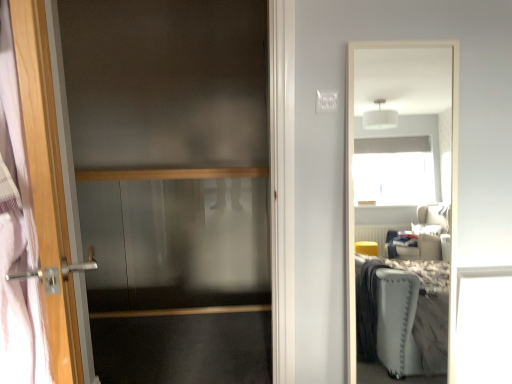
Question: Should I look upward or downward to see transparent glass screen door at left?

Choices:
 (A) down
 (B) up

Answer: (A)

Question: Is transparent glass screen door at left shorter than satin wood balustrade at center?

Choices:
 (A) yes
 (B) no

Answer: (B)

Question: Does transparent glass screen door at left have a smaller size compared to satin wood balustrade at center?

Choices:
 (A) no
 (B) yes

Answer: (A)

Question: Is transparent glass screen door at left looking in the opposite direction of satin wood balustrade at center?

Choices:
 (A) yes
 (B) no

Answer: (A)

Question: Can satin wood balustrade at center be found inside transparent glass screen door at left?

Choices:
 (A) yes
 (B) no

Answer: (B)

Question: Is transparent glass screen door at left wider than satin wood balustrade at center?

Choices:
 (A) no
 (B) yes

Answer: (A)

Question: Can you confirm if transparent glass screen door at left is positioned to the right of satin wood balustrade at center?

Choices:
 (A) yes
 (B) no

Answer: (A)

Question: Is transparent glass screen door at left to the left of wooden door handle at left from the viewer's perspective?

Choices:
 (A) yes
 (B) no

Answer: (B)

Question: Is wooden door handle at left located within transparent glass screen door at left?

Choices:
 (A) no
 (B) yes

Answer: (A)

Question: From the image's perspective, is transparent glass screen door at left below wooden door handle at left?

Choices:
 (A) yes
 (B) no

Answer: (B)

Question: Does transparent glass screen door at left have a greater width compared to wooden door handle at left?

Choices:
 (A) no
 (B) yes

Answer: (A)

Question: Considering the relative sizes of transparent glass screen door at left and wooden door handle at left in the image provided, is transparent glass screen door at left smaller than wooden door handle at left?

Choices:
 (A) yes
 (B) no

Answer: (A)

Question: Is transparent glass screen door at left further to the viewer compared to wooden door handle at left?

Choices:
 (A) yes
 (B) no

Answer: (A)

Question: Is satin wood balustrade at center aimed at wooden door handle at left?

Choices:
 (A) no
 (B) yes

Answer: (B)